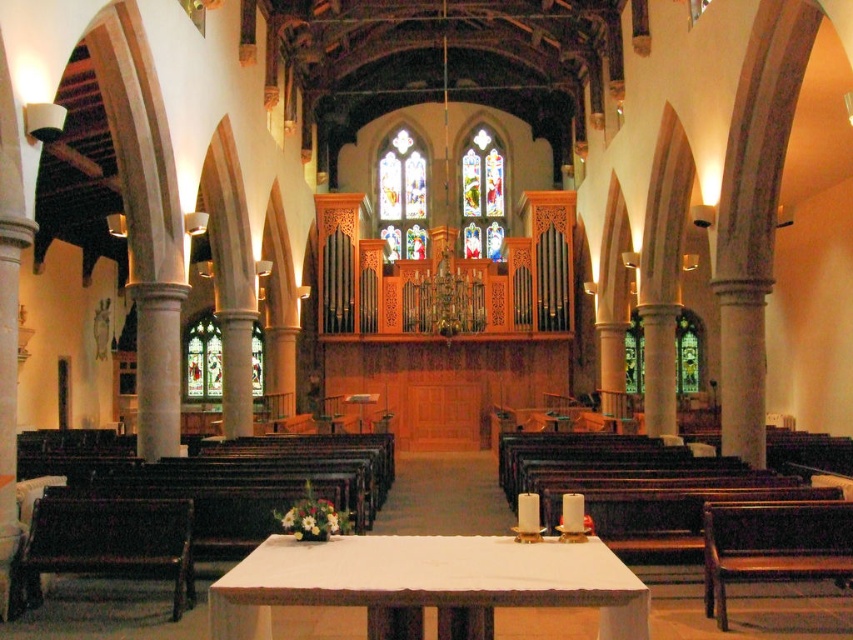
You are standing in the church and want to sit down. You see the dark brown polished wood bench at lower left and the stained glass window at center. Which object is closer to your current position?

The dark brown polished wood bench at lower left is closer to your current position because it is to the left of the stained glass window at center, implying it is nearer in proximity.